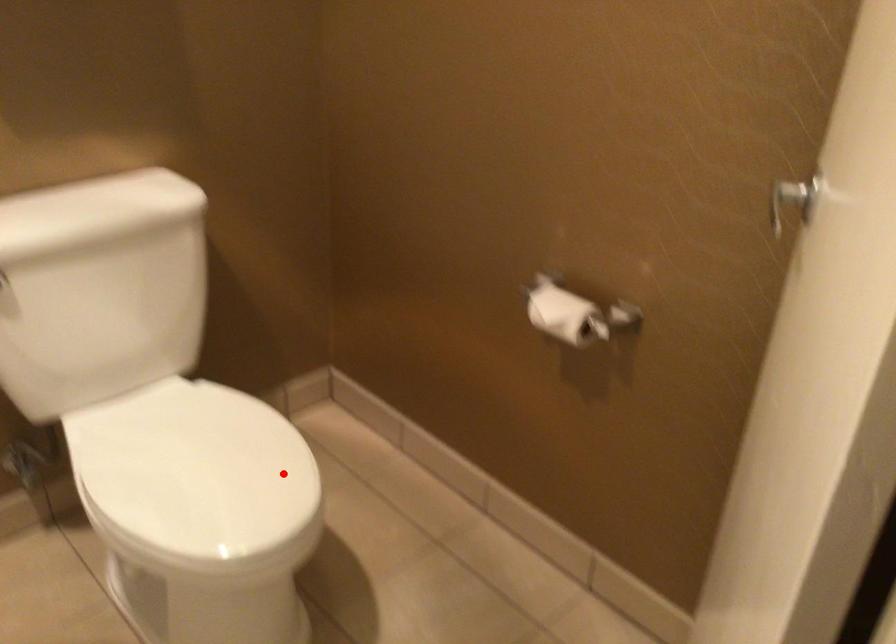
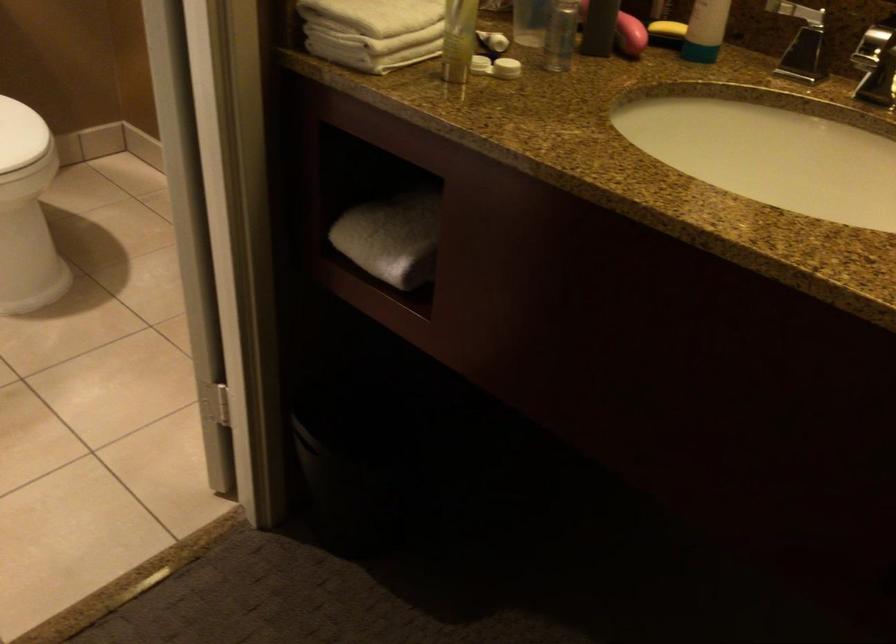
In the second image, find the point that corresponds to the highlighted location in the first image.

(20, 135)